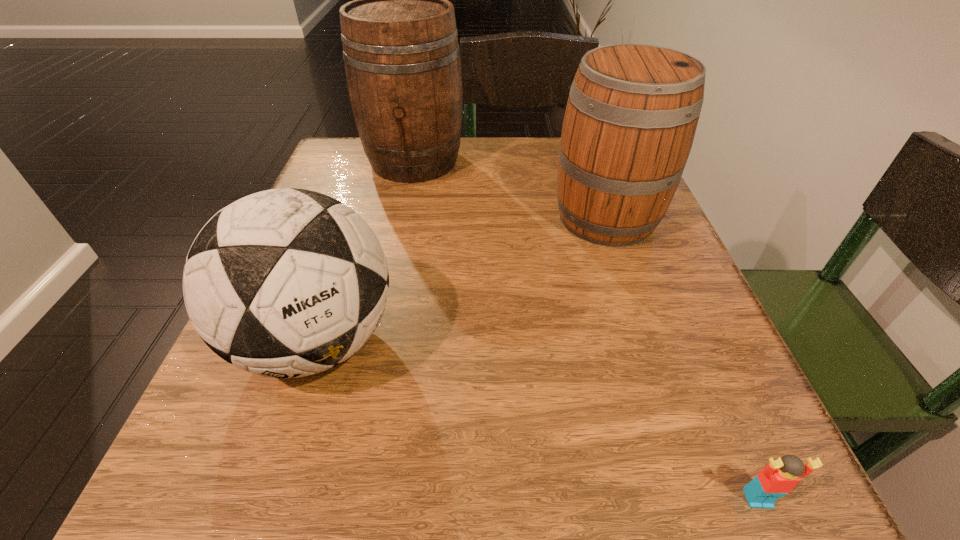
What are the coordinates of `the left cider` in the screenshot? It's located at (402, 62).

I want to click on the right cider, so click(632, 112).

The image size is (960, 540). Identify the location of the second nearest object. (284, 283).

Where is `soccer ball`? soccer ball is located at coordinates (284, 283).

Locate an element on the screen. This screenshot has width=960, height=540. the nearest object is located at coordinates point(778,478).

The width and height of the screenshot is (960, 540). Identify the location of Lego. (778, 478).

The image size is (960, 540). Identify the location of free space located 0.140m on the side of the left cider near the bung hole. (399, 231).

The image size is (960, 540). I want to click on free space located 0.050m on the back of the right cider, so click(591, 174).

In order to click on vacant region located 0.050m on the surface of the third tallest object where the brand logo is visible in this screenshot , I will do `click(279, 456)`.

The height and width of the screenshot is (540, 960). Identify the location of object at the near edge. (778, 478).